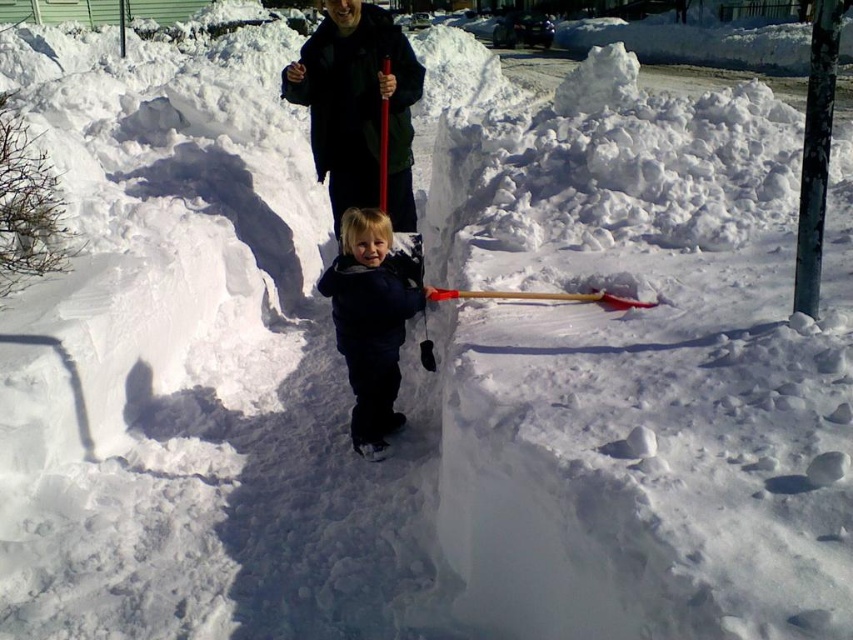
Question: Which of the following is the farthest from the observer?

Choices:
 (A) (463, 291)
 (B) (386, 333)
 (C) (817, 173)
 (D) (334, 216)

Answer: (D)

Question: Can you confirm if dark blue jacket at center is smaller than wooden shovel at center?

Choices:
 (A) no
 (B) yes

Answer: (A)

Question: Among these points, which one is farthest from the camera?

Choices:
 (A) (312, 134)
 (B) (471, 291)

Answer: (A)

Question: Can you confirm if dark blue jacket at center is positioned below wooden shovel at center?

Choices:
 (A) yes
 (B) no

Answer: (B)

Question: Is dark blue fleece jacket at center positioned before smooth gray pole at upper right?

Choices:
 (A) no
 (B) yes

Answer: (A)

Question: Which of the following is the farthest from the observer?

Choices:
 (A) (514, 292)
 (B) (814, 307)
 (C) (350, 97)
 (D) (349, 211)

Answer: (C)